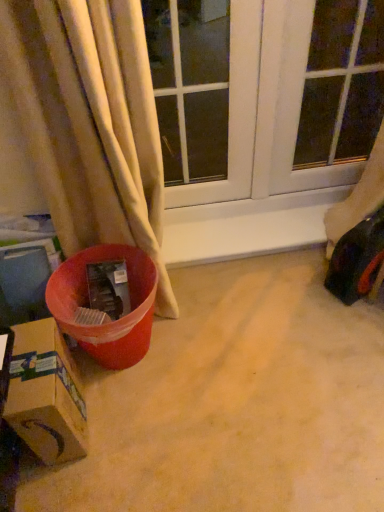
Question: Is cardboard box at lower left at the back of transparent glass window screen at upper right?

Choices:
 (A) no
 (B) yes

Answer: (A)

Question: Considering the relative sizes of transparent glass window screen at upper right and cardboard box at lower left in the image provided, is transparent glass window screen at upper right shorter than cardboard box at lower left?

Choices:
 (A) yes
 (B) no

Answer: (B)

Question: Considering the relative positions of transparent glass window screen at upper right and cardboard box at lower left in the image provided, is transparent glass window screen at upper right to the right of cardboard box at lower left from the viewer's perspective?

Choices:
 (A) no
 (B) yes

Answer: (B)

Question: Is transparent glass window screen at upper right in contact with cardboard box at lower left?

Choices:
 (A) yes
 (B) no

Answer: (B)

Question: Is transparent glass window screen at upper right bigger than cardboard box at lower left?

Choices:
 (A) no
 (B) yes

Answer: (B)

Question: From a real-world perspective, is transparent glass window screen at upper right on cardboard box at lower left?

Choices:
 (A) yes
 (B) no

Answer: (A)

Question: Is shiny plastic toy car at right far from transparent glass window at center?

Choices:
 (A) no
 (B) yes

Answer: (B)

Question: Does shiny plastic toy car at right have a smaller size compared to transparent glass window at center?

Choices:
 (A) no
 (B) yes

Answer: (B)

Question: Does shiny plastic toy car at right have a lesser height compared to transparent glass window at center?

Choices:
 (A) yes
 (B) no

Answer: (A)

Question: Does shiny plastic toy car at right lie behind transparent glass window at center?

Choices:
 (A) no
 (B) yes

Answer: (B)

Question: Is shiny plastic toy car at right beside transparent glass window at center?

Choices:
 (A) no
 (B) yes

Answer: (A)

Question: Is transparent glass window at center completely or partially inside shiny plastic toy car at right?

Choices:
 (A) no
 (B) yes

Answer: (A)

Question: From the image's perspective, is transparent glass window at center above transparent glass window screen at upper right?

Choices:
 (A) yes
 (B) no

Answer: (B)